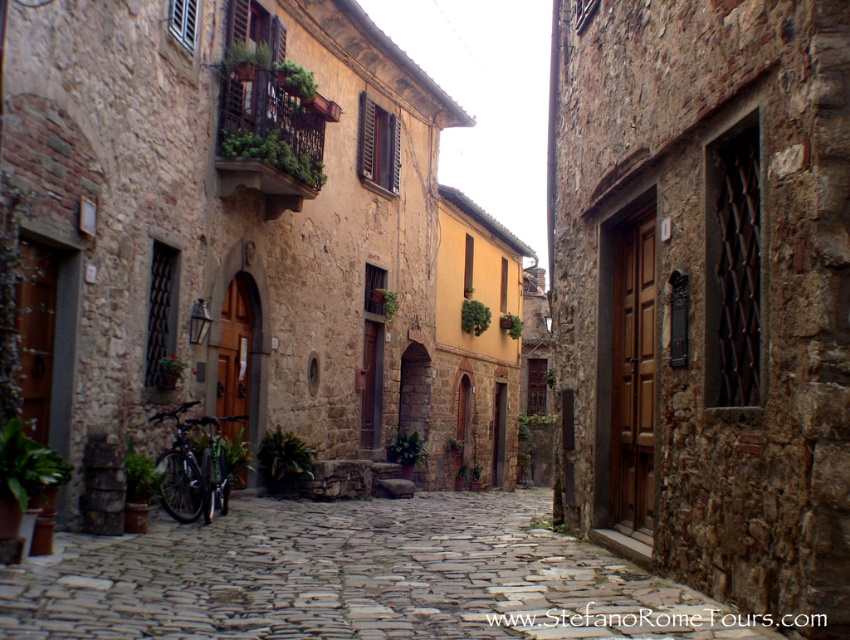
Question: Is brown wooden door at center above stone cobblestone path at center?

Choices:
 (A) no
 (B) yes

Answer: (B)

Question: Which point is farther to the camera?

Choices:
 (A) stone cobblestone path at center
 (B) brown wooden door at center

Answer: (B)

Question: Does brown wooden door at center appear on the right side of stone cobblestone path at center?

Choices:
 (A) no
 (B) yes

Answer: (B)

Question: Is the position of brown wooden door at center more distant than that of stone cobblestone path at center?

Choices:
 (A) no
 (B) yes

Answer: (B)